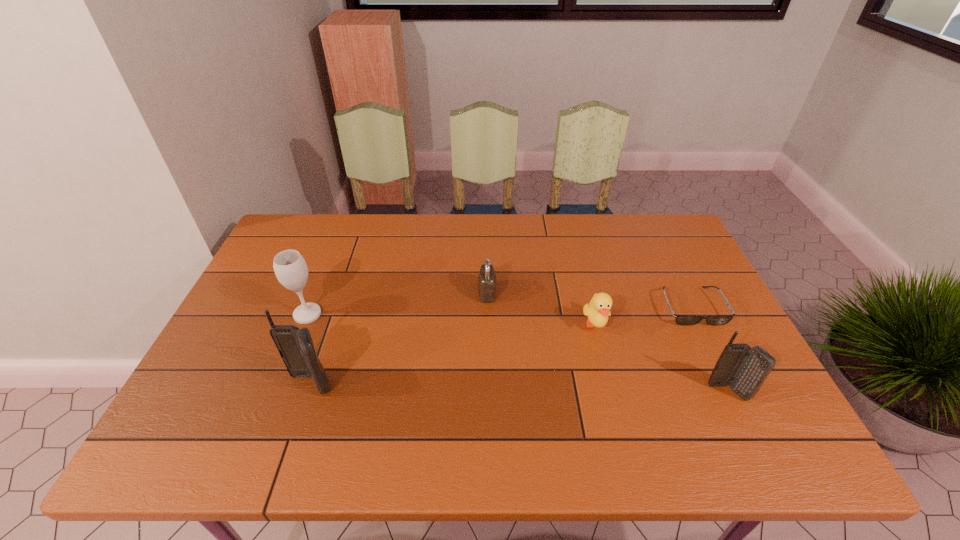
I want to click on blank region between the shortest object and the padlock, so click(x=589, y=300).

Identify the location of empty space that is in between the shorter cellular telephone and the taller cellular telephone. The width and height of the screenshot is (960, 540). [x=519, y=388].

At what (x,y) coordinates should I click in order to perform the action: click on free space between the duckling and the shortest object. Please return your answer as a coordinate pair (x, y). Image resolution: width=960 pixels, height=540 pixels. Looking at the image, I should click on (643, 316).

Identify which object is located as the third nearest to the shortest object. Please provide its 2D coordinates. Your answer should be formatted as a tuple, i.e. [(x, y)], where the tuple contains the x and y coordinates of a point satisfying the conditions above.

[(487, 278)]

Locate which object ranks in proximity to the wineglass. Please provide its 2D coordinates. Your answer should be formatted as a tuple, i.e. [(x, y)], where the tuple contains the x and y coordinates of a point satisfying the conditions above.

[(295, 346)]

At what (x,y) coordinates should I click in order to perform the action: click on vacant space that satisfies the following two spatial constraints: 1. at the front of the third object from left to right near the keyhole; 2. on the keyboard of the taller cellular telephone. Please return your answer as a coordinate pair (x, y). The image size is (960, 540). Looking at the image, I should click on (489, 384).

Locate an element on the screen. free spot that satisfies the following two spatial constraints: 1. at the front of the third object from left to right near the keyhole; 2. on the keyboard of the left cellular telephone is located at coordinates (489, 384).